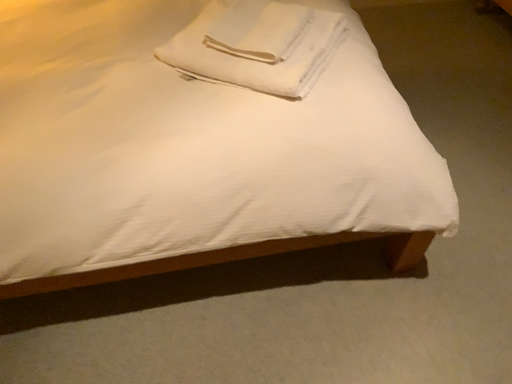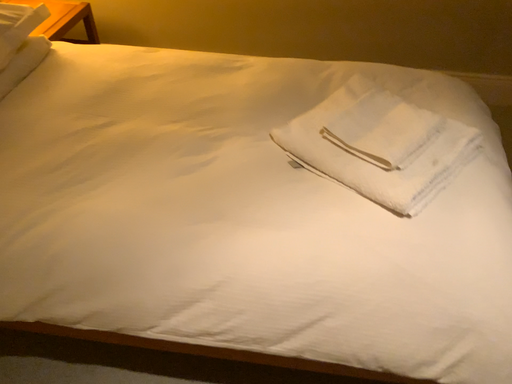
Question: Which way did the camera rotate in the video?

Choices:
 (A) rotated downward
 (B) rotated upward

Answer: (B)